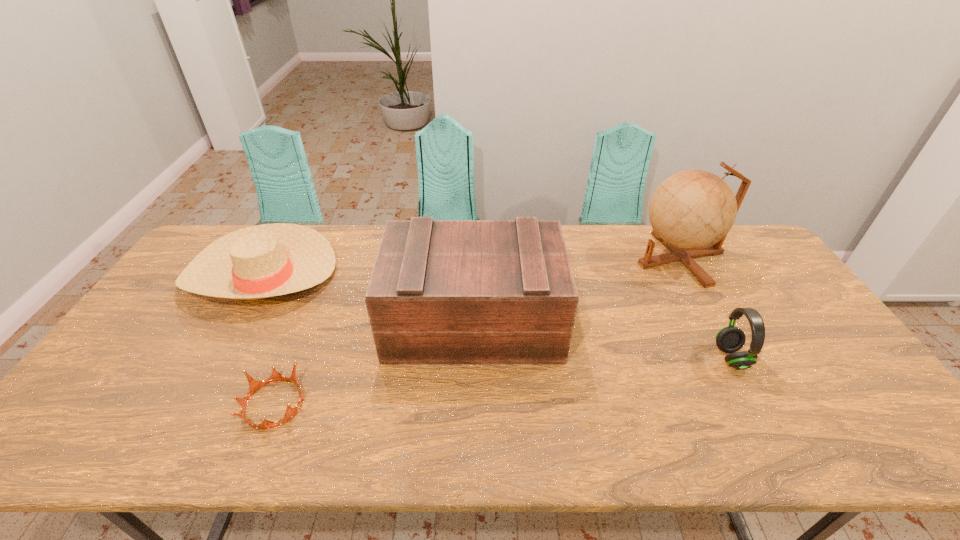
Identify the location of object present at the right edge. This screenshot has width=960, height=540. (691, 212).

The image size is (960, 540). Identify the location of object that is at the far left corner. (267, 260).

Find the location of a particular element. object that is at the far right corner is located at coordinates (x=691, y=212).

Identify the location of blank space at the far edge of the desktop. Image resolution: width=960 pixels, height=540 pixels. (607, 227).

You are a GUI agent. You are given a task and a screenshot of the screen. Output one action in this format:
    pyautogui.click(x=<x>, y=<y>)
    Task: Click on the free region at the near edge of the desktop
    
    Given the screenshot: What is the action you would take?
    pyautogui.click(x=279, y=453)

In the image, there is a desktop. What are the coordinates of `free space at the left edge` in the screenshot? It's located at (174, 346).

This screenshot has width=960, height=540. I want to click on vacant space in between the nearest object and the third shortest object, so point(502,381).

The width and height of the screenshot is (960, 540). What are the coordinates of `unoccupied position between the shortest object and the fourth tallest object` in the screenshot? It's located at (268, 339).

Identify the location of free space that is in between the third shortest object and the box. (602, 339).

Find the location of `free point between the third object from left to right and the tallest object`. free point between the third object from left to right and the tallest object is located at coordinates (577, 289).